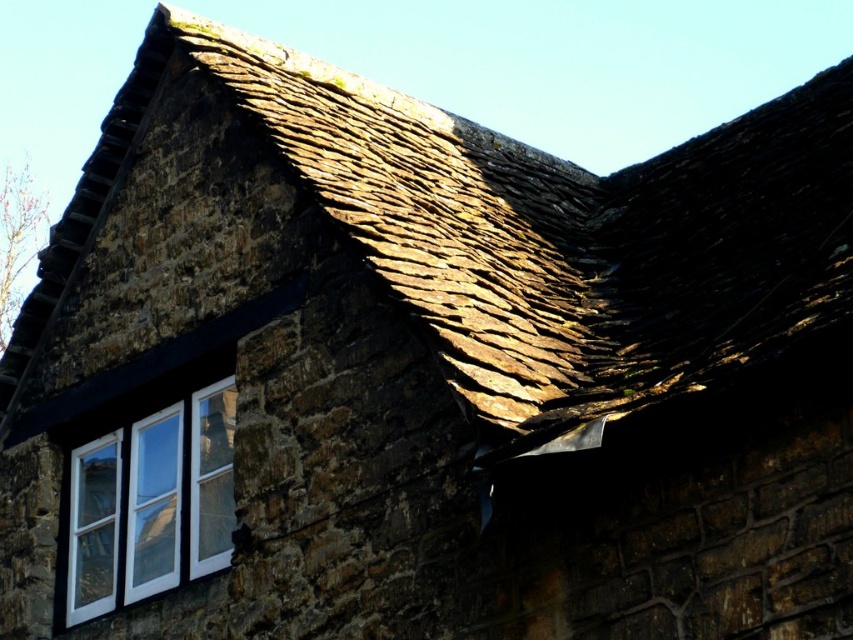
You are an architect designing a new building inspired by this traditional stone building. You need to decide whether to prioritize the width of the brown shingles at upper center or the white wood window at lower left. Based on the image, which element has a greater width?

The brown shingles at upper center have a greater width than the white wood window at lower left according to the description.

You are an architect assessing the traditional stone building. You notice the brown shingles at upper center and the white wood window at lower left. Which object has a bigger size?

The brown shingles at upper center has a larger size compared to the white wood window at lower left.